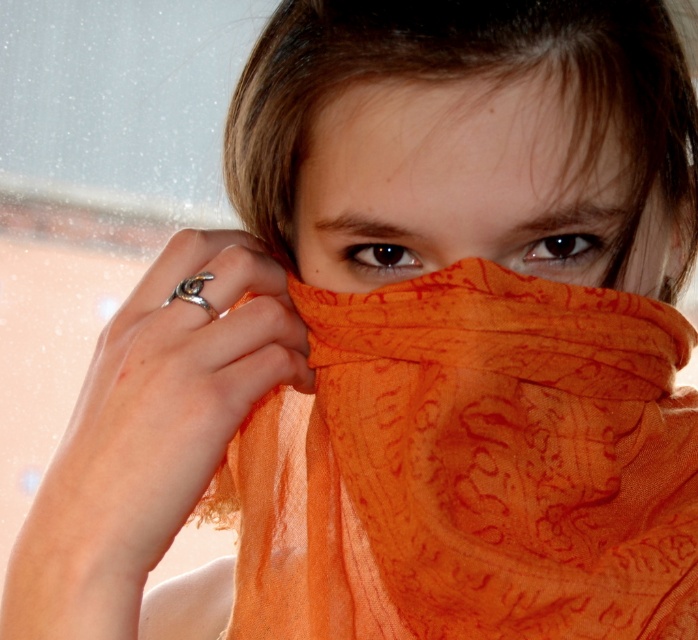
Question: Can you confirm if orange sheer scarf at center is smaller than brown matte eye at center?

Choices:
 (A) no
 (B) yes

Answer: (A)

Question: Among these objects, which one is nearest to the camera?

Choices:
 (A) brown matte eye at center
 (B) brownmatteeyes at center
 (C) orange sheer scarf at center

Answer: (B)

Question: Is orange sheer scarf at center positioned at the back of brown matte eye at upper center?

Choices:
 (A) yes
 (B) no

Answer: (A)

Question: Which point appears farthest from the camera in this image?

Choices:
 (A) (564, 266)
 (B) (339, 532)
 (C) (456, 230)
 (D) (392, 257)

Answer: (B)

Question: Considering the relative positions of orange sheer scarf at center and brownmatteeyes at center in the image provided, where is orange sheer scarf at center located with respect to brownmatteeyes at center?

Choices:
 (A) right
 (B) left

Answer: (B)

Question: Which point is farther to the camera?

Choices:
 (A) (258, 616)
 (B) (378, 273)

Answer: (A)